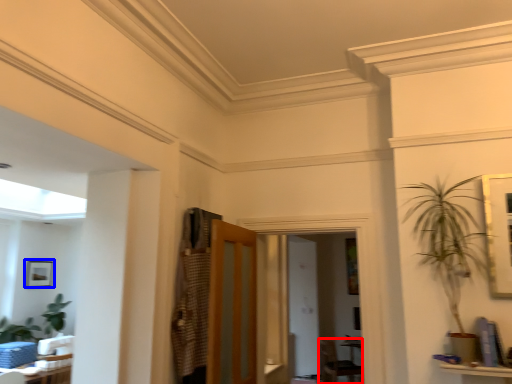
Question: Which object is further to the camera taking this photo, armchair (highlighted by a red box) or picture frame (highlighted by a blue box)?

Choices:
 (A) armchair
 (B) picture frame

Answer: (A)